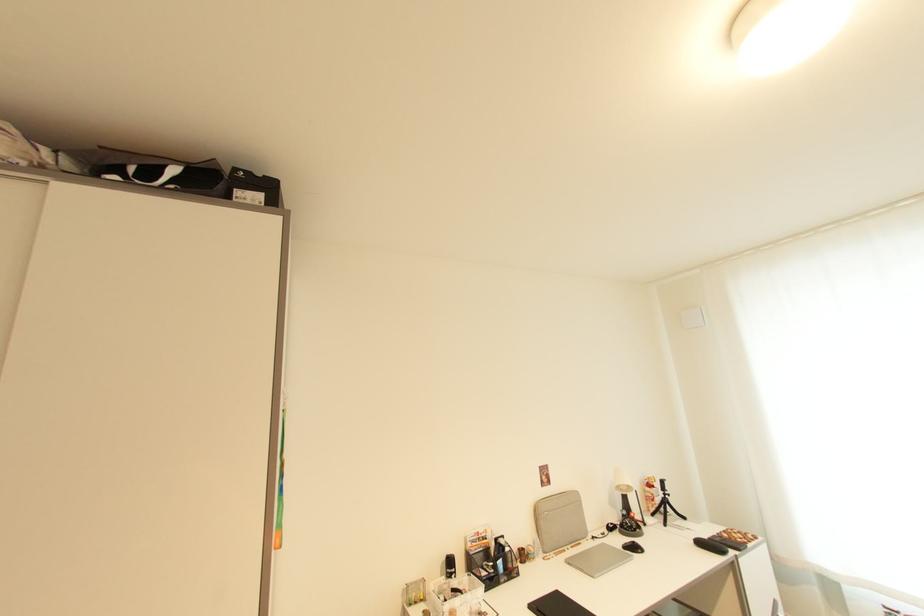
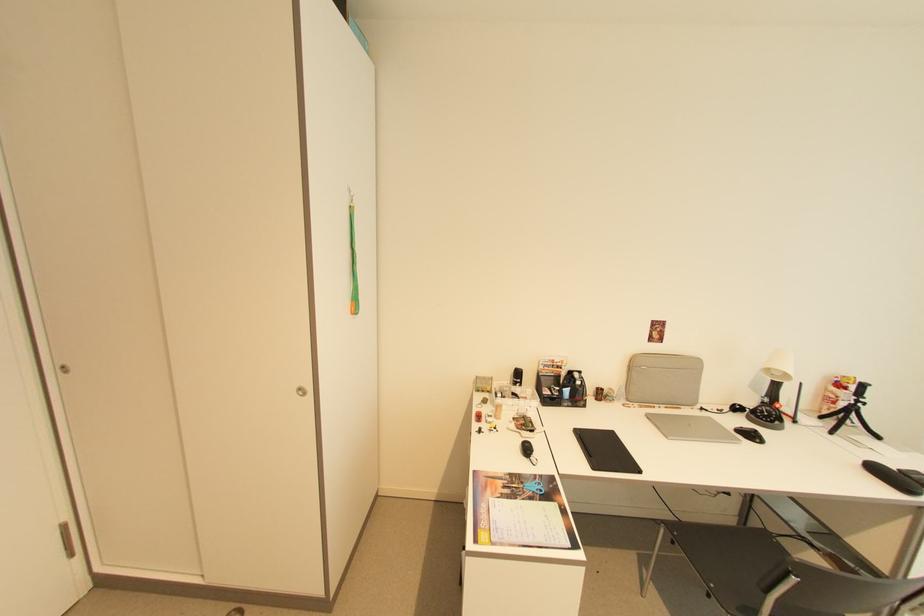
Locate, in the second image, the point that corresponds to point (542, 514) in the first image.

(638, 366)